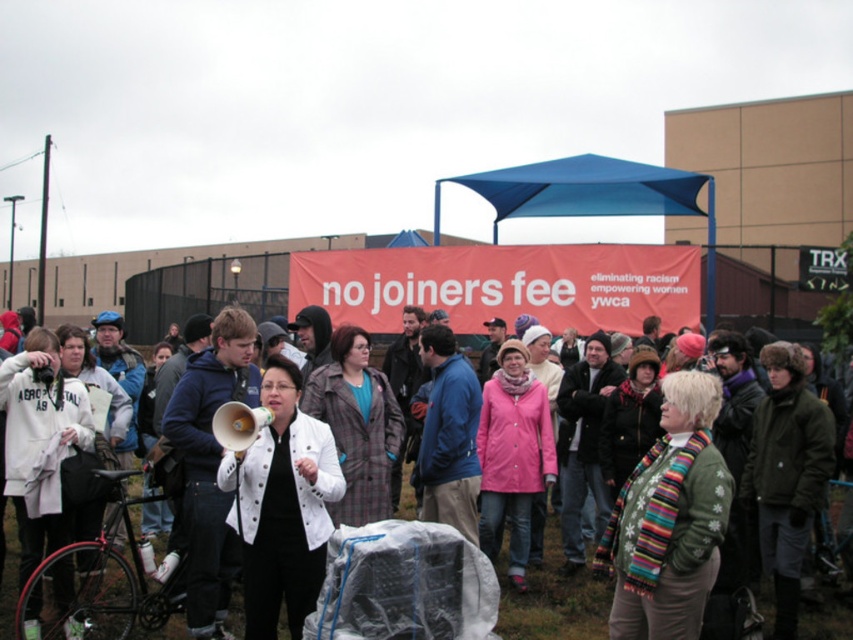
You are standing at the viewer position in the image. There is a point marked at coordinates point (199, 547). Can you reach that point without moving past the crowd in front of you?

The distance between point (199, 547) and the viewer is 22.16 feet. Since the crowd is in front of you, you would need to move through them to reach the point, which may not be advisable or possible without causing disruption.

You are a photographer trying to capture a photo of both the matte green megaphone at center and the dark blue jacket at center in the same frame. Your camera has a maximum focus range of 25 feet. Will you be able to include both objects in your shot?

The matte green megaphone at center and dark blue jacket at center are 25.50 feet apart. Since your camera can only focus up to 25 feet, the distance between them exceeds the maximum range. Therefore, you cannot capture both in the same focused shot.

You are organizing a protest and need to distribute megaphones to participants. You have a blue fleece jacket at center and a matte green megaphone at center. Which item is bigger in size?

The blue fleece jacket at center has a larger size compared to the matte green megaphone at center, so the blue fleece jacket at center is bigger.